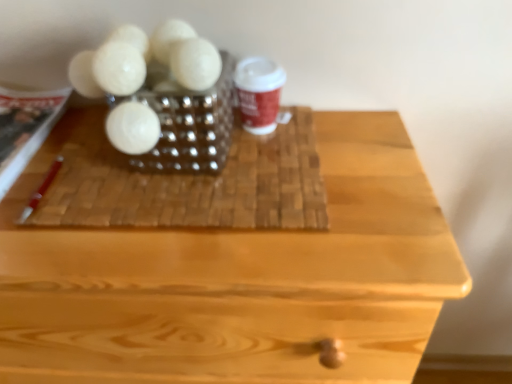
The width and height of the screenshot is (512, 384). In order to click on free space above wooden table at center (from a real-world perspective) in this screenshot , I will do point(187,193).